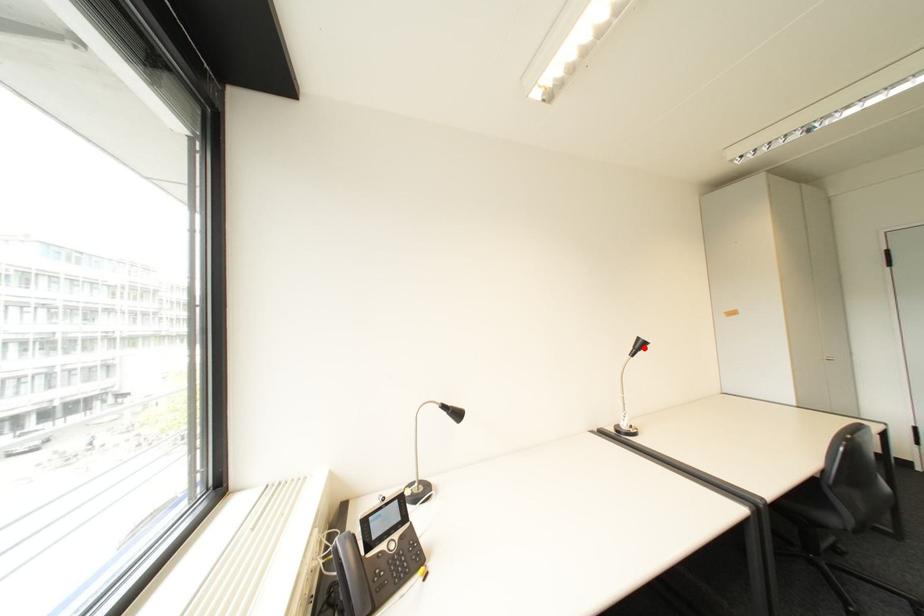
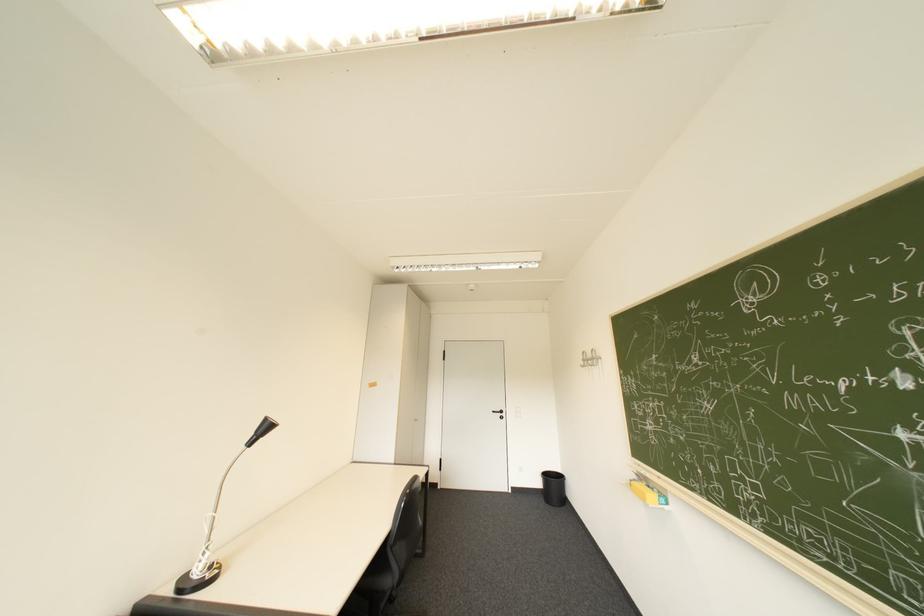
Where in the second image is the point corresponding to the highlighted location from the first image?

(266, 434)